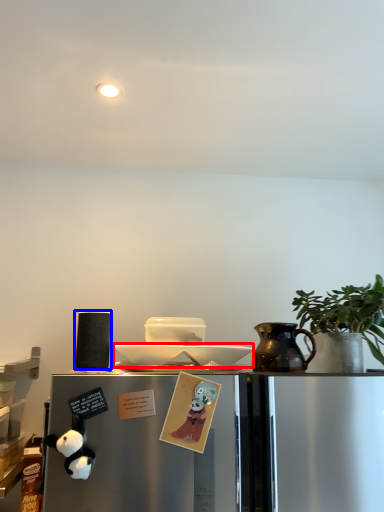
Question: Among these objects, which one is nearest to the camera, plate (highlighted by a red box) or appliance (highlighted by a blue box)?

Choices:
 (A) plate
 (B) appliance

Answer: (A)